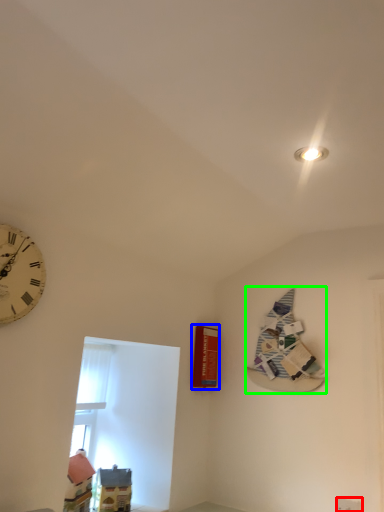
Question: Based on their relative distances, which object is nearer to electric outlet (highlighted by a red box)? Choose from magazine (highlighted by a blue box) and book (highlighted by a green box).

Choices:
 (A) magazine
 (B) book

Answer: (B)